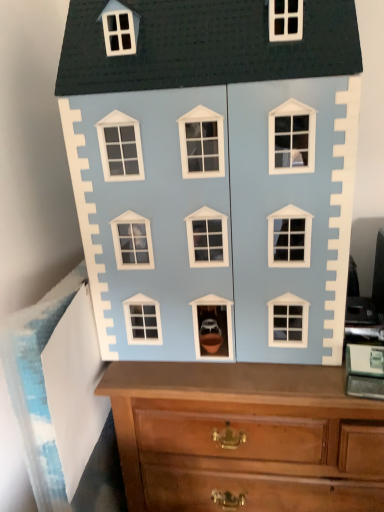
The height and width of the screenshot is (512, 384). Describe the element at coordinates (246, 436) in the screenshot. I see `wooden chest of drawers at center` at that location.

The height and width of the screenshot is (512, 384). Identify the location of wooden chest of drawers at center. (246, 436).

Measure the distance between light blue matte house at center and camera.

light blue matte house at center is 30.38 inches from camera.

This screenshot has width=384, height=512. Describe the element at coordinates (214, 173) in the screenshot. I see `light blue matte house at center` at that location.

Identify the location of light blue matte house at center. (214, 173).

What is the approximate height of light blue matte house at center?

The height of light blue matte house at center is 33.33 inches.

Locate an element on the screen. The width and height of the screenshot is (384, 512). wooden chest of drawers at center is located at coordinates (246, 436).

In the scene shown: Based on their positions, is wooden chest of drawers at center located to the left or right of light blue matte house at center?

wooden chest of drawers at center is positioned on light blue matte house at center's right side.

Is wooden chest of drawers at center further to camera compared to light blue matte house at center?

Yes.

Is point (345, 446) positioned in front of point (312, 108)?

No.

From the image's perspective, would you say wooden chest of drawers at center is positioned over light blue matte house at center?

No.

From a real-world perspective, who is located lower, wooden chest of drawers at center or light blue matte house at center?

wooden chest of drawers at center, from a real-world perspective.

Considering the sizes of wooden chest of drawers at center and light blue matte house at center in the image, is wooden chest of drawers at center wider or thinner than light blue matte house at center?

In the image, wooden chest of drawers at center appears to be wider than light blue matte house at center.

Is wooden chest of drawers at center taller than light blue matte house at center?

Yes.

Can you confirm if wooden chest of drawers at center is smaller than light blue matte house at center?

Incorrect, wooden chest of drawers at center is not smaller in size than light blue matte house at center.

Is wooden chest of drawers at center located outside light blue matte house at center?

wooden chest of drawers at center lies outside light blue matte house at center's area.

From the picture: Is wooden chest of drawers at center beside light blue matte house at center?

No, wooden chest of drawers at center is not with light blue matte house at center.

Is wooden chest of drawers at center facing away from light blue matte house at center?

No, wooden chest of drawers at center's orientation is not away from light blue matte house at center.

Locate an element on the screen. This screenshot has width=384, height=512. the chest of drawers below the light blue matte house at center (from a real-world perspective) is located at coordinates (246, 436).

Considering the relative positions of light blue matte house at center and wooden chest of drawers at center in the image provided, is light blue matte house at center to the right of wooden chest of drawers at center from the viewer's perspective?

Incorrect, light blue matte house at center is not on the right side of wooden chest of drawers at center.

Which object is closer to the camera taking this photo, light blue matte house at center or wooden chest of drawers at center?

Positioned in front is light blue matte house at center.

Between point (322, 151) and point (153, 401), which one is positioned in front?

Positioned in front is point (322, 151).

From the image's perspective, is light blue matte house at center beneath wooden chest of drawers at center?

No, from the image's perspective, light blue matte house at center is not below wooden chest of drawers at center.

In the scene shown: From a real-world perspective, is light blue matte house at center on top of wooden chest of drawers at center?

Yes, from a real-world perspective, light blue matte house at center is over wooden chest of drawers at center

Which of these two, light blue matte house at center or wooden chest of drawers at center, is wider?

wooden chest of drawers at center.

Which of these two, light blue matte house at center or wooden chest of drawers at center, stands taller?

With more height is wooden chest of drawers at center.

In the scene shown: Is light blue matte house at center smaller than wooden chest of drawers at center?

Indeed, light blue matte house at center has a smaller size compared to wooden chest of drawers at center.

Choose the correct answer: Is light blue matte house at center inside wooden chest of drawers at center or outside it?

light blue matte house at center is outside wooden chest of drawers at center.

Are light blue matte house at center and wooden chest of drawers at center far apart?

No, light blue matte house at center is in close proximity to wooden chest of drawers at center.

Is light blue matte house at center facing away from wooden chest of drawers at center?

light blue matte house at center is not turned away from wooden chest of drawers at center.

Looking at this image, what's the angular difference between light blue matte house at center and wooden chest of drawers at center's facing directions?

1.47 degrees.

Find the location of `toy on the left of wooden chest of drawers at center`. toy on the left of wooden chest of drawers at center is located at coordinates click(x=214, y=173).

What are the coordinates of `toy on the left of the wooden chest of drawers at center` in the screenshot? It's located at (214, 173).

In order to click on chest of drawers below the light blue matte house at center (from a real-world perspective) in this screenshot , I will do `click(246, 436)`.